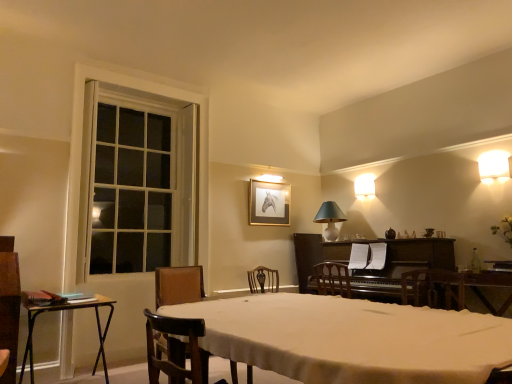
Question: Does wooden table at center have a greater height compared to white ceramic lampshade at upper center, which is the third lamp from top to bottom?

Choices:
 (A) yes
 (B) no

Answer: (A)

Question: Is wooden table at center to the right of white ceramic lampshade at upper center, the 1th lamp when ordered from left to right, from the viewer's perspective?

Choices:
 (A) no
 (B) yes

Answer: (A)

Question: From the image's perspective, is wooden table at center below white ceramic lampshade at upper center, which appears as the 1th lamp when ordered from the bottom?

Choices:
 (A) no
 (B) yes

Answer: (B)

Question: Is the depth of wooden table at center greater than that of white ceramic lampshade at upper center, which appears as the 1th lamp when ordered from the bottom?

Choices:
 (A) no
 (B) yes

Answer: (A)

Question: Considering the relative positions of wooden table at center and white ceramic lampshade at upper center, which appears as the 1th lamp when ordered from the bottom, in the image provided, is wooden table at center to the left of white ceramic lampshade at upper center, which appears as the 1th lamp when ordered from the bottom, from the viewer's perspective?

Choices:
 (A) no
 (B) yes

Answer: (B)

Question: Is metallic gold picture frame at upper center wider or thinner than dark polished wood piano at center-right?

Choices:
 (A) wide
 (B) thin

Answer: (B)

Question: Considering the relative positions of metallic gold picture frame at upper center and dark polished wood piano at center-right in the image provided, is metallic gold picture frame at upper center to the left or to the right of dark polished wood piano at center-right?

Choices:
 (A) right
 (B) left

Answer: (B)

Question: From the image's perspective, relative to dark polished wood piano at center-right, is metallic gold picture frame at upper center above or below?

Choices:
 (A) above
 (B) below

Answer: (A)

Question: Is metallic gold picture frame at upper center situated inside dark polished wood piano at center-right or outside?

Choices:
 (A) inside
 (B) outside

Answer: (B)

Question: Is white glossy wall sconce at upper right, the 1th lamp when ordered from front to back, taller or shorter than white wood window at left?

Choices:
 (A) short
 (B) tall

Answer: (A)

Question: Does point (503, 163) appear closer or farther from the camera than point (162, 157)?

Choices:
 (A) closer
 (B) farther

Answer: (A)

Question: From the image's perspective, is white glossy wall sconce at upper right, which appears as the first lamp when viewed from the right, positioned above or below white wood window at left?

Choices:
 (A) above
 (B) below

Answer: (A)

Question: Is white glossy wall sconce at upper right, the first lamp viewed from the top, wider or thinner than white wood window at left?

Choices:
 (A) wide
 (B) thin

Answer: (A)

Question: From the image's perspective, relative to matte white lampshade at upper right, the third lamp from the front, is metallic gold picture frame at upper center above or below?

Choices:
 (A) above
 (B) below

Answer: (B)

Question: From their relative heights in the image, would you say metallic gold picture frame at upper center is taller or shorter than matte white lampshade at upper right, which appears as the second lamp when viewed from the left?

Choices:
 (A) tall
 (B) short

Answer: (A)